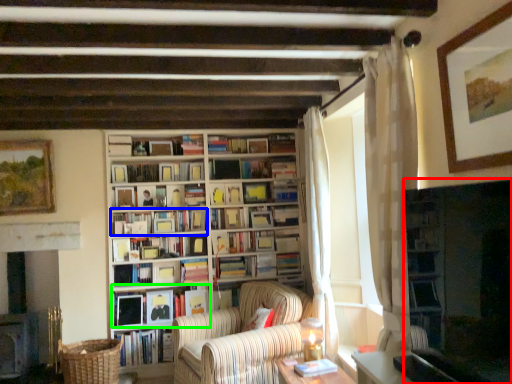
Question: Considering the real-world distances, which object is farthest from shelf (highlighted by a red box)? book (highlighted by a blue box) or book (highlighted by a green box)?

Choices:
 (A) book
 (B) book

Answer: (B)